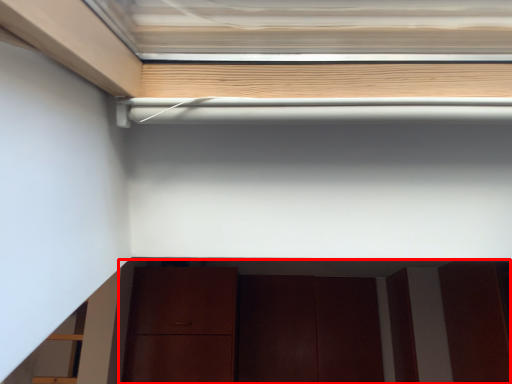
Question: In this image, where is cabinetry (annotated by the red box) located relative to door?

Choices:
 (A) left
 (B) right

Answer: (B)